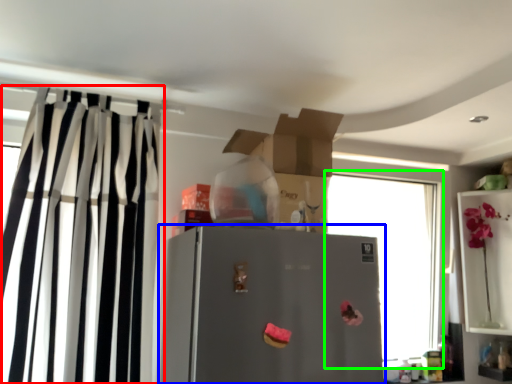
Question: Which object is the closest to the curtain (highlighted by a red box)? Choose among these: refrigerator (highlighted by a blue box) or window (highlighted by a green box).

Choices:
 (A) refrigerator
 (B) window

Answer: (A)